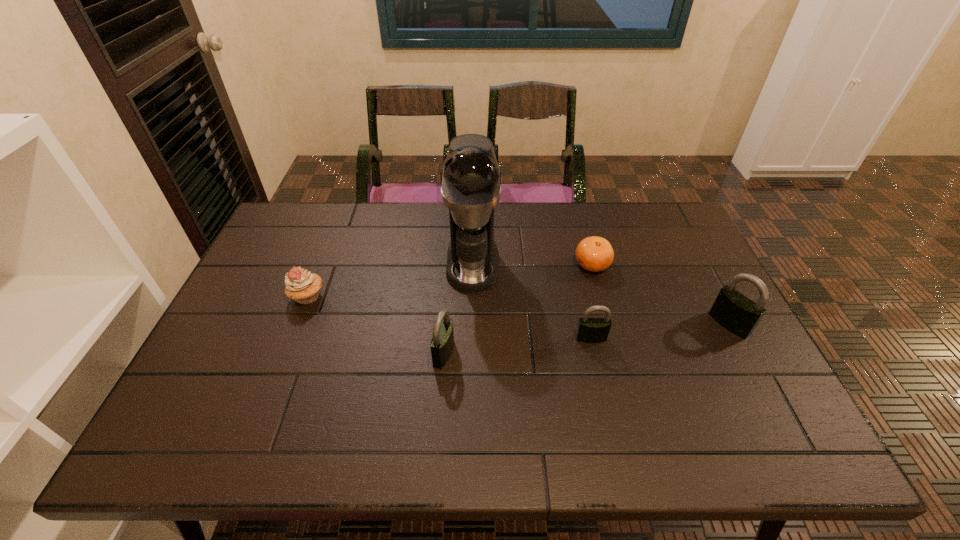
Find the location of a particular element. The image size is (960, 540). free spot located place cup under the spout of the coffee maker is located at coordinates (470, 372).

This screenshot has width=960, height=540. What are the coordinates of `vacant region located 0.060m on the left of the clementine` in the screenshot? It's located at (554, 265).

Locate an element on the screen. The image size is (960, 540). free point located on the front of the cupcake is located at coordinates (284, 356).

I want to click on object that is at the far edge, so click(x=470, y=176).

The width and height of the screenshot is (960, 540). Find the location of `object that is at the left edge`. object that is at the left edge is located at coordinates (302, 286).

Locate an element on the screen. Image resolution: width=960 pixels, height=540 pixels. object present at the right edge is located at coordinates (738, 314).

Image resolution: width=960 pixels, height=540 pixels. In the image, there is a desktop. What are the coordinates of `vacant space at the far edge` in the screenshot? It's located at (512, 233).

In the image, there is a desktop. Where is `vacant space at the near edge`? The width and height of the screenshot is (960, 540). vacant space at the near edge is located at coordinates (431, 397).

Locate an element on the screen. blank space at the left edge of the desktop is located at coordinates (261, 258).

This screenshot has height=540, width=960. Identify the location of vacant point at the far left corner. (317, 227).